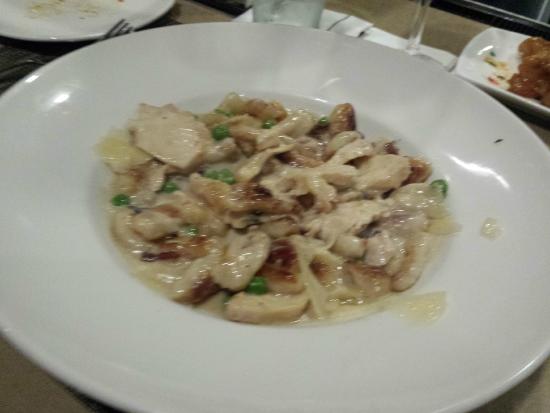
The width and height of the screenshot is (550, 413). Find the location of `table top`. table top is located at coordinates (34, 388), (537, 393), (539, 126), (447, 31), (399, 16), (194, 14).